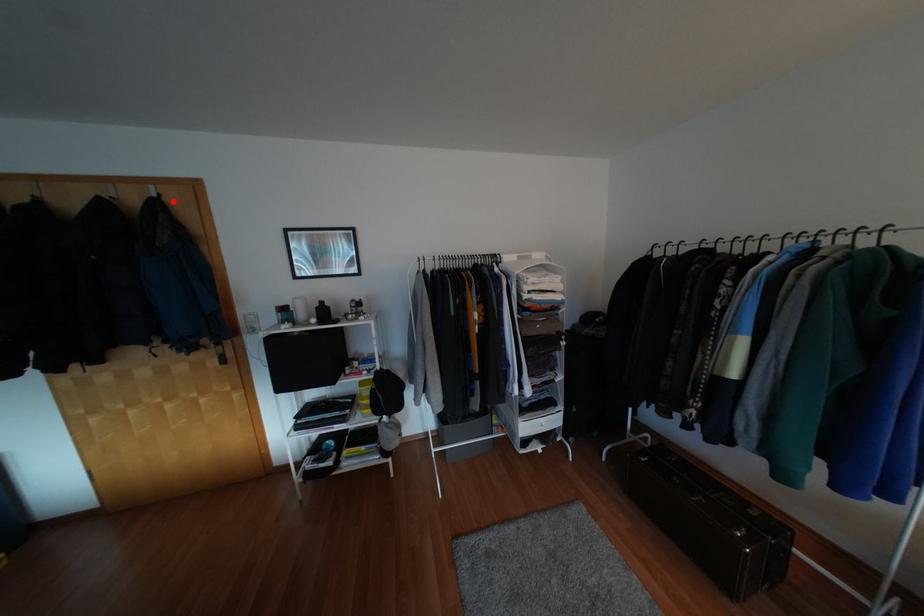
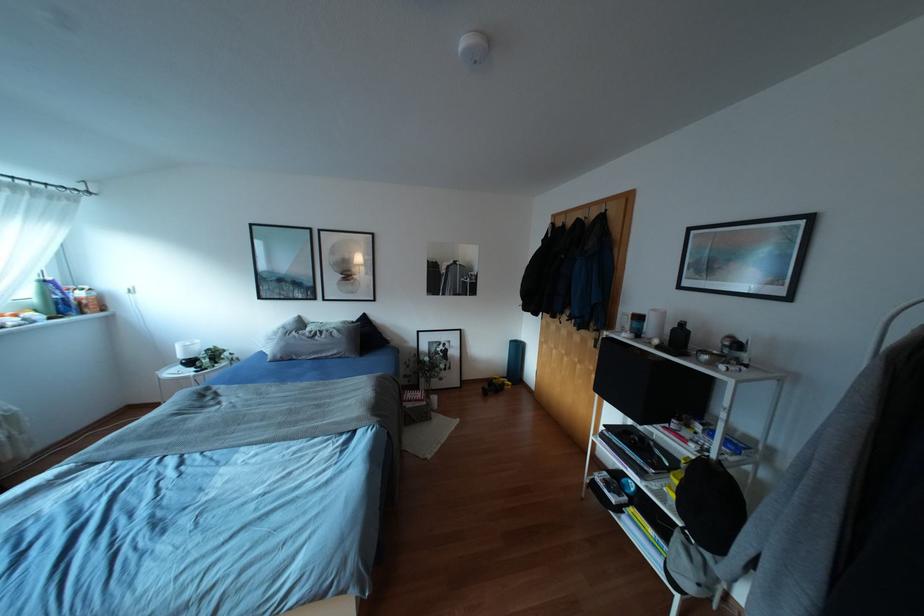
Find the pixel in the second image that matches the highlighted location in the first image.

(612, 214)